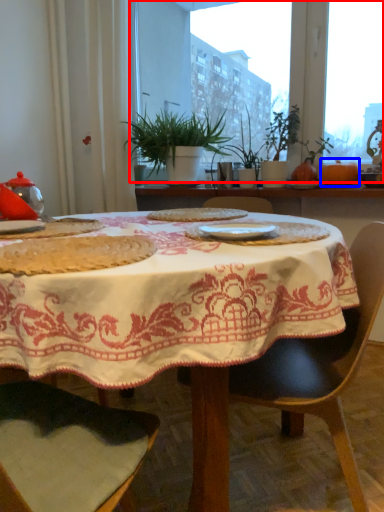
Question: Which of the following is the farthest to the observer, window screen (highlighted by a red box) or pumpkin (highlighted by a blue box)?

Choices:
 (A) window screen
 (B) pumpkin

Answer: (B)